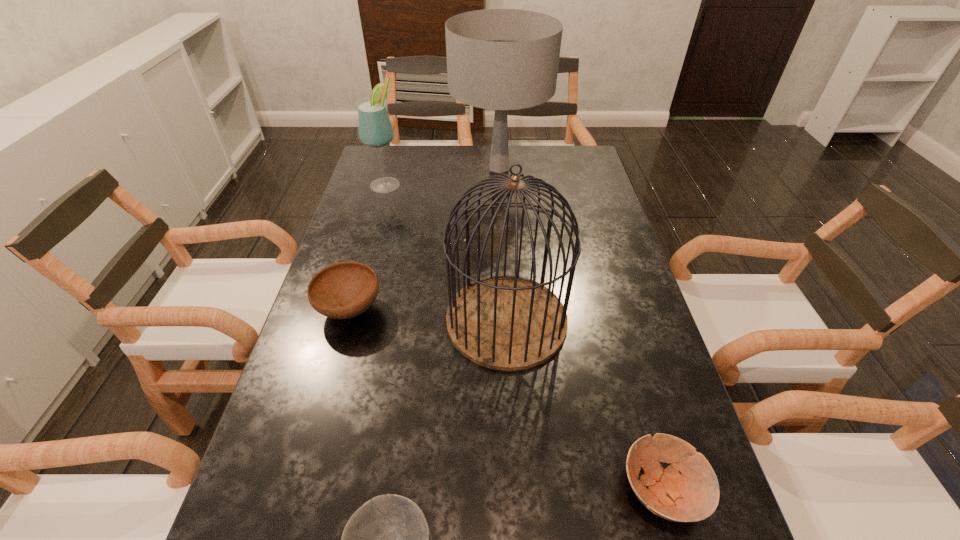
Identify which bowl is located as the third nearest to the third tallest object. Please provide its 2D coordinates. Your answer should be formatted as a tuple, i.e. [(x, y)], where the tuple contains the x and y coordinates of a point satisfying the conditions above.

[(692, 496)]

Find the location of a particular element. The width and height of the screenshot is (960, 540). bowl that stands as the closest to the third tallest object is located at coordinates (343, 290).

This screenshot has width=960, height=540. Find the location of `free spot that satisfies the following two spatial constraints: 1. at the door of the birdcage; 2. on the right side of the rightmost bowl`. free spot that satisfies the following two spatial constraints: 1. at the door of the birdcage; 2. on the right side of the rightmost bowl is located at coordinates (516, 490).

At what (x,y) coordinates should I click in order to perform the action: click on free point that satisfies the following two spatial constraints: 1. on the front-facing side of the lampshade; 2. at the door of the birdcage. Please return your answer as a coordinate pair (x, y). This screenshot has width=960, height=540. Looking at the image, I should click on (508, 320).

Locate an element on the screen. The height and width of the screenshot is (540, 960). blank area in the image that satisfies the following two spatial constraints: 1. at the door of the birdcage; 2. on the left side of the rightmost bowl is located at coordinates (516, 490).